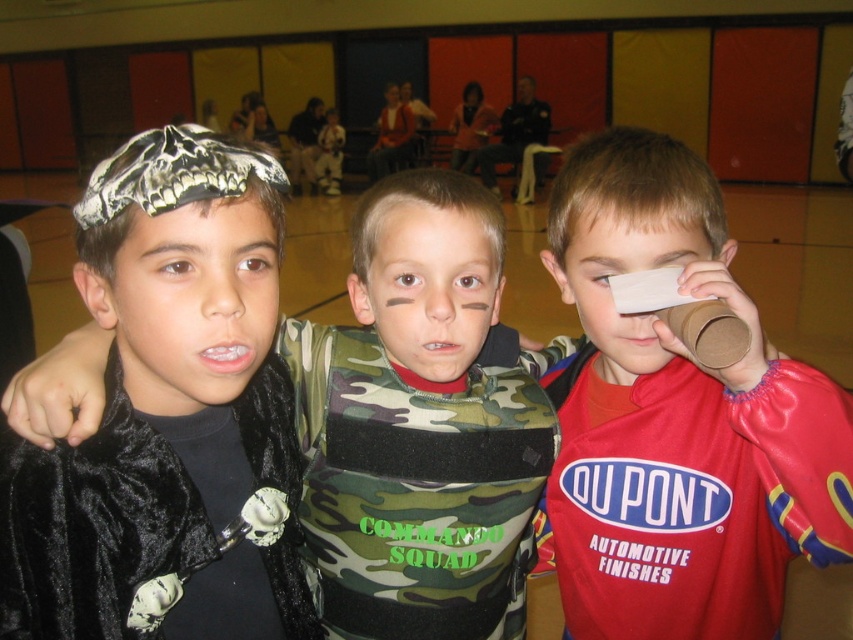
Is matte red shirt at center behind matte black headband at center?

Yes, it is.

What do you see at coordinates (677, 419) in the screenshot? I see `matte red shirt at center` at bounding box center [677, 419].

Locate an element on the screen. This screenshot has width=853, height=640. matte red shirt at center is located at coordinates pyautogui.click(x=677, y=419).

Can you confirm if camouflage fabric at center is bigger than red matte paper at right?

No.

What do you see at coordinates (428, 289) in the screenshot? I see `camouflage fabric at center` at bounding box center [428, 289].

This screenshot has width=853, height=640. I want to click on camouflage fabric at center, so click(x=428, y=289).

Which is more to the left, velvet black cape at left or camouflage fabric at center?

velvet black cape at left

Is point (143, 188) more distant than point (393, 224)?

No, (143, 188) is in front of (393, 224).

Which is behind, point (245, 170) or point (415, 371)?

The point (415, 371) is behind.

You are a GUI agent. You are given a task and a screenshot of the screen. Output one action in this format:
    pyautogui.click(x=<x>, y=<y>)
    Task: Click on the velvet black cape at left
    This screenshot has width=853, height=640.
    Given the screenshot: What is the action you would take?
    pyautogui.click(x=165, y=406)